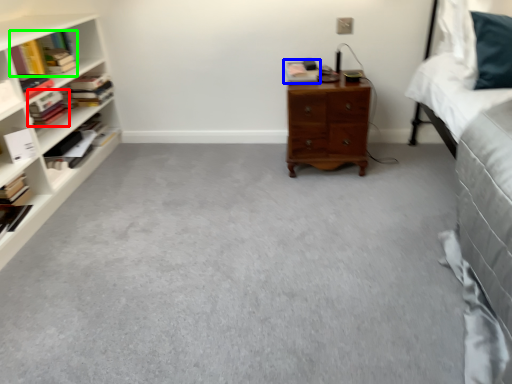
Question: Considering the real-world distances, which object is farthest from book (highlighted by a red box)? book (highlighted by a blue box) or book (highlighted by a green box)?

Choices:
 (A) book
 (B) book

Answer: (A)